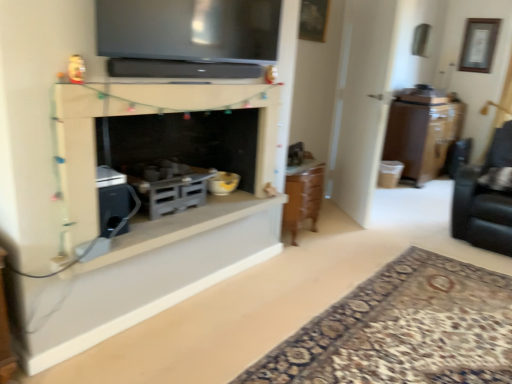
Question: Is the position of white smooth baseboard at lower center, the first window sill from the bottom, less distant than that of carpet with intricate pattern at lower right?

Choices:
 (A) no
 (B) yes

Answer: (A)

Question: Is white smooth baseboard at lower center, the first window sill from the bottom, bigger than carpet with intricate pattern at lower right?

Choices:
 (A) yes
 (B) no

Answer: (B)

Question: Is white smooth baseboard at lower center, which ranks as the 2th window sill in top-to-bottom order, looking in the opposite direction of carpet with intricate pattern at lower right?

Choices:
 (A) no
 (B) yes

Answer: (A)

Question: Is white smooth baseboard at lower center, the first window sill from the bottom, completely or partially outside of carpet with intricate pattern at lower right?

Choices:
 (A) yes
 (B) no

Answer: (A)

Question: Is white smooth baseboard at lower center, which ranks as the 2th window sill in top-to-bottom order, at the right side of carpet with intricate pattern at lower right?

Choices:
 (A) yes
 (B) no

Answer: (B)

Question: Is white smooth baseboard at lower center, which ranks as the 2th window sill in top-to-bottom order, wider than carpet with intricate pattern at lower right?

Choices:
 (A) no
 (B) yes

Answer: (A)

Question: From the image's perspective, would you say matte gray stove at center, the 1th appliance ordered from the bottom, is positioned over brown wood cabinet at right?

Choices:
 (A) yes
 (B) no

Answer: (B)

Question: Considering the relative positions of matte gray stove at center, the 1th appliance ordered from the bottom, and brown wood cabinet at right in the image provided, is matte gray stove at center, the 1th appliance ordered from the bottom, to the left of brown wood cabinet at right from the viewer's perspective?

Choices:
 (A) yes
 (B) no

Answer: (A)

Question: Is matte gray stove at center, the 1th appliance ordered from the bottom, to the right of brown wood cabinet at right from the viewer's perspective?

Choices:
 (A) yes
 (B) no

Answer: (B)

Question: From a real-world perspective, is matte gray stove at center, the third appliance when ordered from top to bottom, below brown wood cabinet at right?

Choices:
 (A) no
 (B) yes

Answer: (A)

Question: Is matte gray stove at center, the third appliance when ordered from top to bottom, smaller than brown wood cabinet at right?

Choices:
 (A) yes
 (B) no

Answer: (A)

Question: Does matte gray stove at center, the 1th appliance ordered from the bottom, come behind brown wood cabinet at right?

Choices:
 (A) no
 (B) yes

Answer: (A)

Question: Is wooden framed artwork at upper right, which is the 2th picture frame in front-to-back order, taller than black leather swivel chair at right?

Choices:
 (A) yes
 (B) no

Answer: (B)